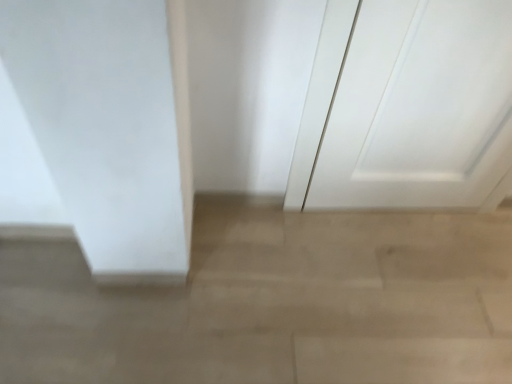
At what (x,y) coordinates should I click in order to perform the action: click on vacant area that lies to the right of white matte door at upper right. Please return your answer as a coordinate pair (x, y). The image size is (512, 384). Looking at the image, I should click on (463, 242).